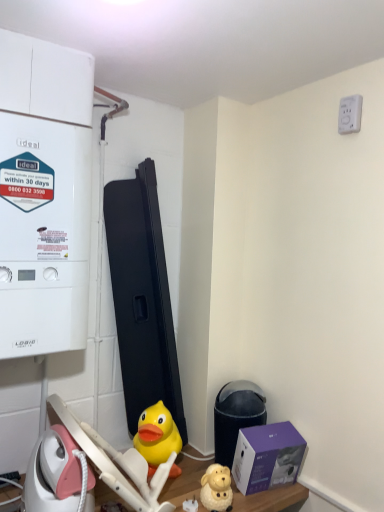
Question: Should I look upward or downward to see black plastic water heater at lower right?

Choices:
 (A) down
 (B) up

Answer: (A)

Question: Are purple matte box at lower right and white plastic electric outlet at upper right making contact?

Choices:
 (A) no
 (B) yes

Answer: (A)

Question: From a real-world perspective, does purple matte box at lower right stand above white plastic electric outlet at upper right?

Choices:
 (A) no
 (B) yes

Answer: (A)

Question: Considering the relative sizes of purple matte box at lower right and white plastic electric outlet at upper right in the image provided, is purple matte box at lower right thinner than white plastic electric outlet at upper right?

Choices:
 (A) no
 (B) yes

Answer: (A)

Question: Considering the relative positions of purple matte box at lower right and white plastic electric outlet at upper right in the image provided, is purple matte box at lower right to the left of white plastic electric outlet at upper right from the viewer's perspective?

Choices:
 (A) yes
 (B) no

Answer: (A)

Question: Is purple matte box at lower right not near white plastic electric outlet at upper right?

Choices:
 (A) no
 (B) yes

Answer: (B)

Question: Is purple matte box at lower right shorter than white plastic electric outlet at upper right?

Choices:
 (A) no
 (B) yes

Answer: (A)

Question: From the image's perspective, is white plastic electric outlet at upper right located above purple matte box at lower right?

Choices:
 (A) no
 (B) yes

Answer: (B)

Question: Are white plastic electric outlet at upper right and purple matte box at lower right located far from each other?

Choices:
 (A) yes
 (B) no

Answer: (A)

Question: Does white plastic electric outlet at upper right have a lesser width compared to purple matte box at lower right?

Choices:
 (A) no
 (B) yes

Answer: (B)

Question: Is white plastic electric outlet at upper right directly adjacent to purple matte box at lower right?

Choices:
 (A) no
 (B) yes

Answer: (A)

Question: Can you confirm if white plastic electric outlet at upper right is positioned to the right of purple matte box at lower right?

Choices:
 (A) no
 (B) yes

Answer: (B)

Question: Does white plastic electric outlet at upper right have a lesser height compared to purple matte box at lower right?

Choices:
 (A) yes
 (B) no

Answer: (A)

Question: From the image's perspective, is yellow rubber duck at center, which is the second toy in front-to-back order, beneath black plastic water heater at lower right?

Choices:
 (A) yes
 (B) no

Answer: (A)